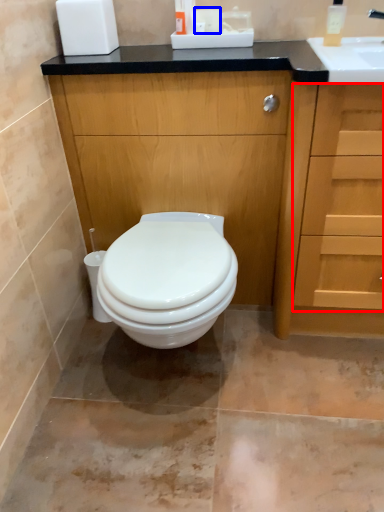
Question: Which object is further to the camera taking this photo, drawer (highlighted by a red box) or toilet paper (highlighted by a blue box)?

Choices:
 (A) drawer
 (B) toilet paper

Answer: (B)